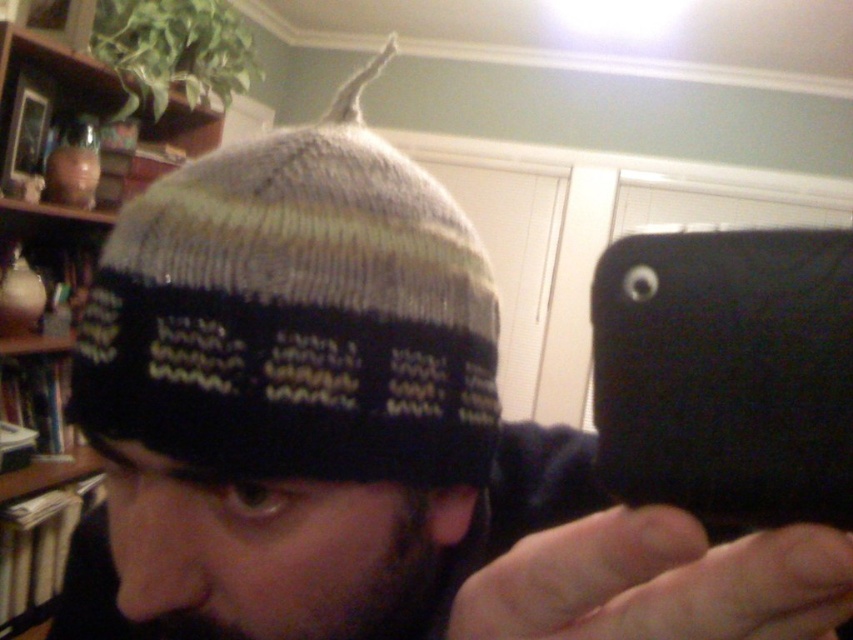
Between point (190, 193) and point (15, 67), which one is positioned in front?

Positioned in front is point (190, 193).

Find the location of a particular element. knitted woolen hat at center is located at coordinates (296, 316).